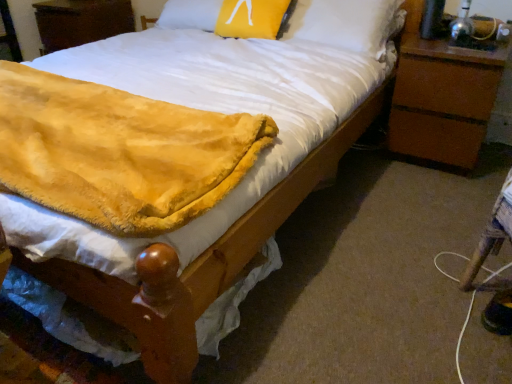
Locate an element on the screen. This screenshot has width=512, height=384. vacant area that is in front of brown wood nightstand at right, marked as the 1th nightstand in a bottom-to-top arrangement is located at coordinates (445, 188).